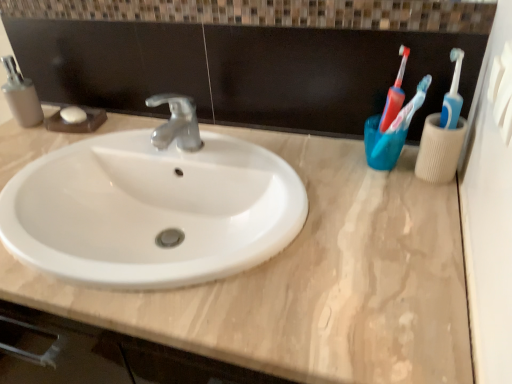
The width and height of the screenshot is (512, 384). I want to click on free location to the left of translucent blue toothbrush at upper right, so click(x=318, y=173).